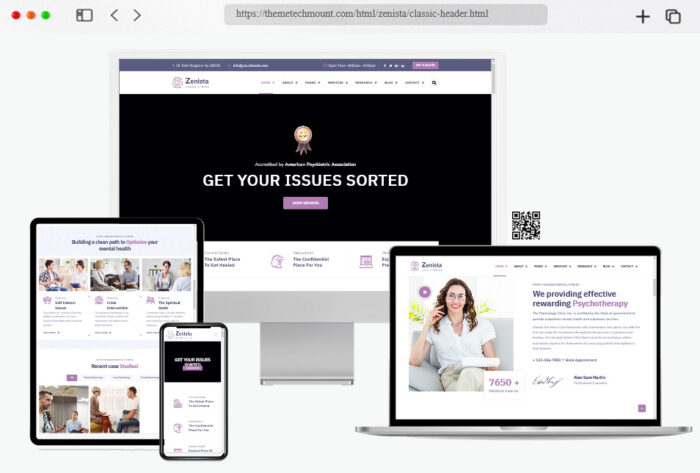
The image size is (700, 473). Identify the location of graphic image of mac monitor. (309, 335).